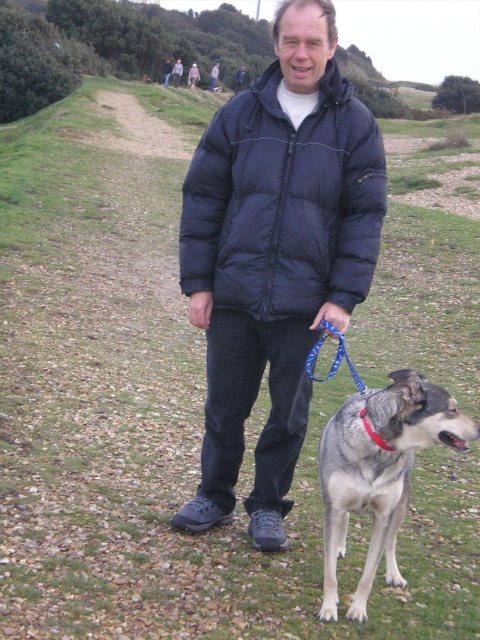
Is point (95, 144) closer to viewer compared to point (352, 378)?

That is False.

Which is in front, point (184, 157) or point (312, 353)?

Point (312, 353) is more forward.

What do you see at coordinates (140, 129) in the screenshot? I see `dirt/gravel path at center` at bounding box center [140, 129].

The width and height of the screenshot is (480, 640). Find the location of `dirt/gravel path at center`. dirt/gravel path at center is located at coordinates (140, 129).

Is navy puffer jacket at center above red fabric neckband at dog right?

Indeed, navy puffer jacket at center is positioned over red fabric neckband at dog right.

Between point (256, 304) and point (382, 438), which one is positioned behind?

The point (256, 304) is more distant.

In the scene shown: Who is more distant from viewer, [321,260] or [372,440]?

Point [321,260]

Identify the location of navy puffer jacket at center. The height and width of the screenshot is (640, 480). (284, 204).

Does dark blue puffy jacket at center have a greater height compared to dirt/gravel path at center?

No, dark blue puffy jacket at center is not taller than dirt/gravel path at center.

The width and height of the screenshot is (480, 640). Describe the element at coordinates (276, 257) in the screenshot. I see `dark blue puffy jacket at center` at that location.

Locate an element on the screen. This screenshot has width=480, height=640. dark blue puffy jacket at center is located at coordinates (276, 257).